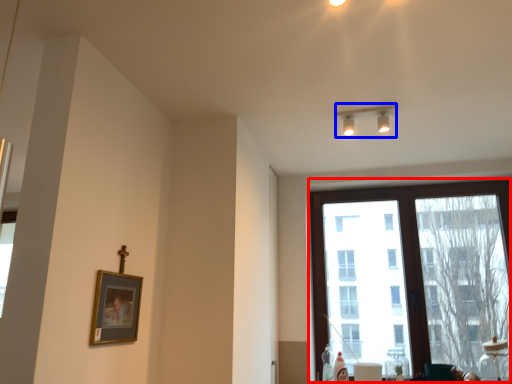
Question: Which object is closer to the camera taking this photo, window (highlighted by a red box) or lamp (highlighted by a blue box)?

Choices:
 (A) window
 (B) lamp

Answer: (B)